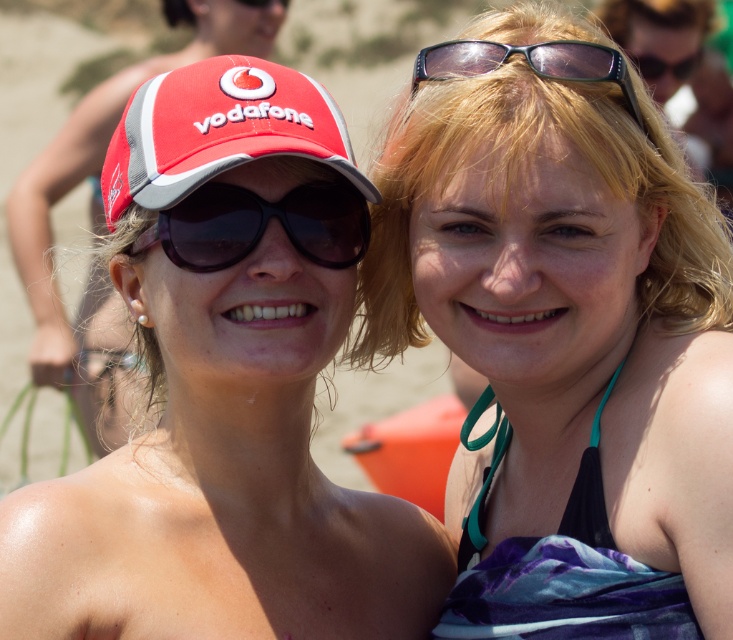
Which is more to the right, matte red cap at center or black plastic goggles at center?

From the viewer's perspective, black plastic goggles at center appears more on the right side.

Where is `matte red cap at center`? matte red cap at center is located at coordinates (226, 392).

Can you confirm if matte black bikini top at center is positioned below black plastic goggles at center?

Indeed, matte black bikini top at center is positioned under black plastic goggles at center.

Between point (550, 595) and point (232, 186), which one is positioned behind?

Point (232, 186)

This screenshot has width=733, height=640. I want to click on matte black bikini top at center, so click(x=564, y=346).

Is matte black bikini top at center thinner than red mesh cap at left?

No.

Is matte black bikini top at center above red mesh cap at left?

Incorrect, matte black bikini top at center is not positioned above red mesh cap at left.

Measure the distance between matte black bikini top at center and camera.

matte black bikini top at center is 17.09 feet from camera.

Where is `matte black bikini top at center`? Image resolution: width=733 pixels, height=640 pixels. matte black bikini top at center is located at coordinates (564, 346).